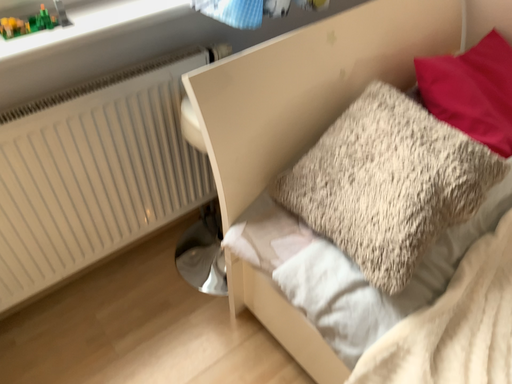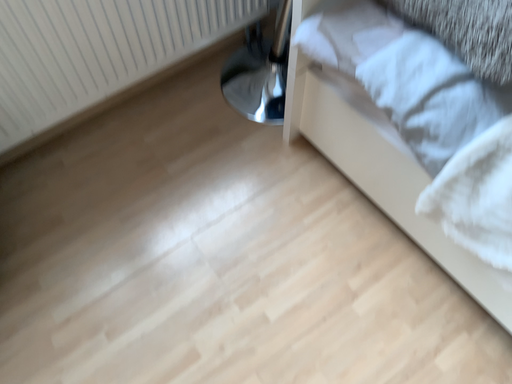
Question: How did the camera likely rotate when shooting the video?

Choices:
 (A) rotated upward
 (B) rotated downward

Answer: (B)